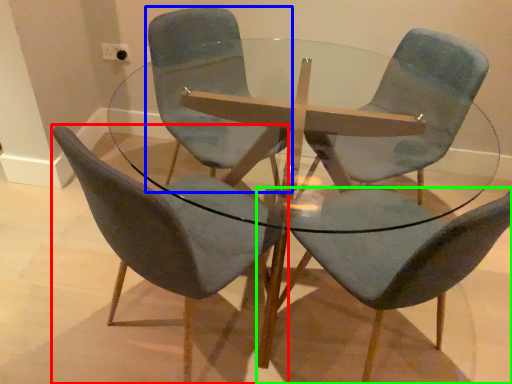
Question: Which is farther away from chair (highlighted by a red box)? chair (highlighted by a blue box) or chair (highlighted by a green box)?

Choices:
 (A) chair
 (B) chair

Answer: (A)